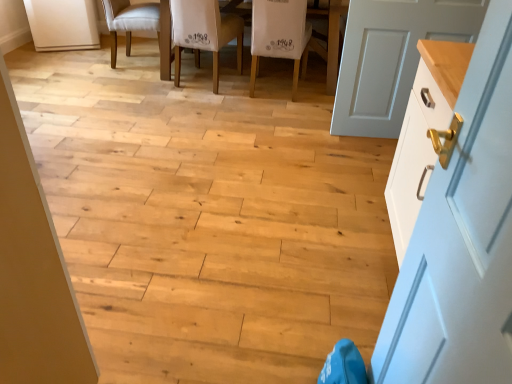
Question: Considering the positions of white fabric chair at center, which is the 2th chair from right to left, and wooden floor at center in the image, is white fabric chair at center, which is the 2th chair from right to left, bigger or smaller than wooden floor at center?

Choices:
 (A) small
 (B) big

Answer: (A)

Question: From the image's perspective, is white fabric chair at center, the 2th chair when ordered from left to right, positioned above or below wooden floor at center?

Choices:
 (A) above
 (B) below

Answer: (A)

Question: Considering the real-world distances, which object is closest to the white fabric chair at upper center, which appears as the first chair when viewed from the left?

Choices:
 (A) wooden floor at center
 (B) white fabric chair at center, marked as the first chair in a right-to-left arrangement
 (C) white painted wood door at right, the 2th door when ordered from bottom to top
 (D) wooden table at center
 (E) white fabric chair at center, the 2th chair when ordered from left to right

Answer: (E)

Question: Based on their relative distances, which object is farther from the white fabric chair at center, which is the 2th chair from right to left?

Choices:
 (A) wooden table at center
 (B) white painted wood door at right, which appears as the second door when viewed from the front
 (C) wooden floor at center
 (D) white glossy door at right, the second door positioned from the top
 (E) white fabric chair at upper center, which appears as the first chair when viewed from the left

Answer: (D)